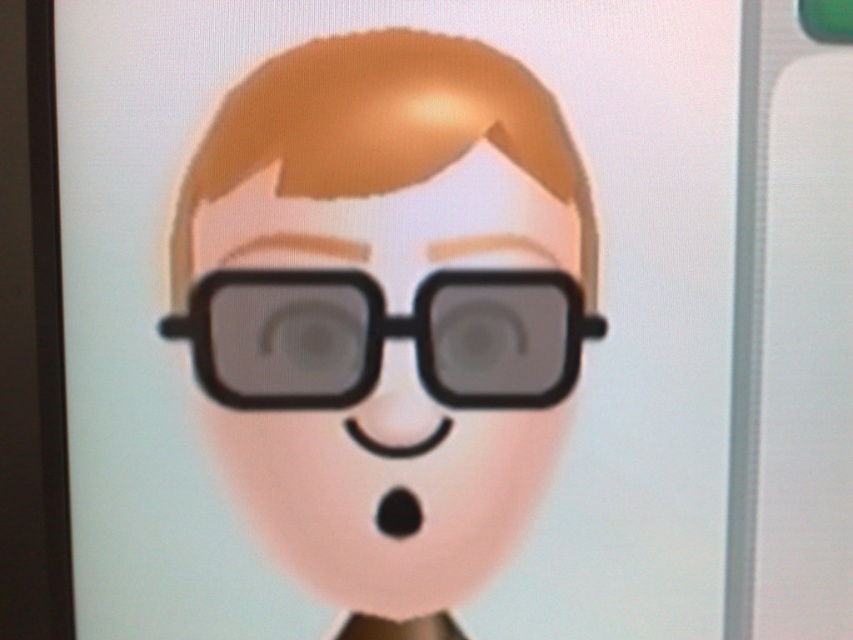
Does matte black glasses at center have a greater height compared to black matte glasses at center?

Indeed, matte black glasses at center has a greater height compared to black matte glasses at center.

Can you confirm if matte black glasses at center is bigger than black matte glasses at center?

Correct, matte black glasses at center is larger in size than black matte glasses at center.

Identify the location of matte black glasses at center. This screenshot has height=640, width=853. (389, 490).